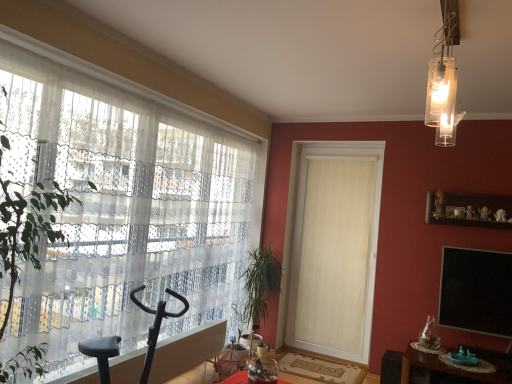
Question: From the image's perspective, would you say green leafy plant at center is shown under white textured door at center?

Choices:
 (A) yes
 (B) no

Answer: (A)

Question: From the image's perspective, is green leafy plant at center above white textured door at center?

Choices:
 (A) yes
 (B) no

Answer: (B)

Question: Is white textured door at center surrounded by green leafy plant at center?

Choices:
 (A) yes
 (B) no

Answer: (B)

Question: From a real-world perspective, does green leafy plant at center stand above white textured door at center?

Choices:
 (A) yes
 (B) no

Answer: (B)

Question: Is green leafy plant at center in contact with white textured door at center?

Choices:
 (A) yes
 (B) no

Answer: (B)

Question: Is clear glass pendant light at upper right taller or shorter than white textured door at center?

Choices:
 (A) tall
 (B) short

Answer: (B)

Question: Is point (451, 127) closer or farther from the camera than point (371, 269)?

Choices:
 (A) farther
 (B) closer

Answer: (B)

Question: In the image, is clear glass pendant light at upper right positioned in front of or behind white textured door at center?

Choices:
 (A) behind
 (B) front

Answer: (B)

Question: Is clear glass pendant light at upper right bigger or smaller than white textured door at center?

Choices:
 (A) big
 (B) small

Answer: (B)

Question: Considering the positions of wooden shelf at upper right and wooden tray at lower right in the image, is wooden shelf at upper right wider or thinner than wooden tray at lower right?

Choices:
 (A) thin
 (B) wide

Answer: (A)

Question: In terms of size, does wooden shelf at upper right appear bigger or smaller than wooden tray at lower right?

Choices:
 (A) small
 (B) big

Answer: (A)

Question: Is point (461, 195) closer or farther from the camera than point (402, 382)?

Choices:
 (A) farther
 (B) closer

Answer: (A)

Question: From a real-world perspective, is wooden shelf at upper right positioned above or below wooden tray at lower right?

Choices:
 (A) below
 (B) above

Answer: (B)

Question: Visually, is green leafy plant at left positioned to the left or to the right of black matte screen at upper right?

Choices:
 (A) left
 (B) right

Answer: (A)

Question: Is point (2, 228) positioned closer to the camera than point (453, 312)?

Choices:
 (A) farther
 (B) closer

Answer: (B)